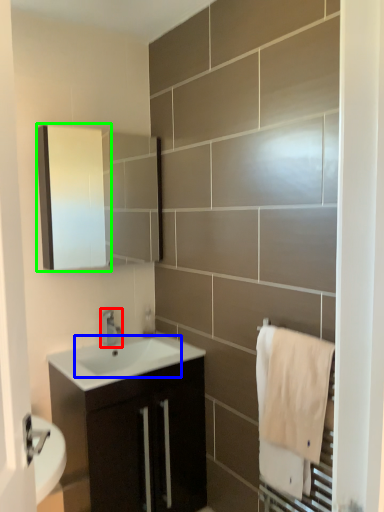
Question: Based on their relative distances, which object is farther from tap (highlighted by a red box)? Choose from sink (highlighted by a blue box) and medicine cabinet (highlighted by a green box).

Choices:
 (A) sink
 (B) medicine cabinet

Answer: (B)